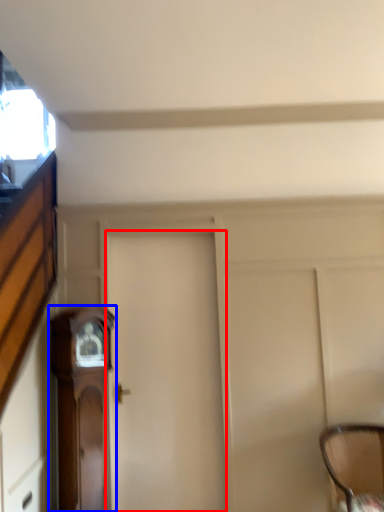
Question: Which of the following is the farthest to the observer, door (highlighted by a red box) or furniture (highlighted by a blue box)?

Choices:
 (A) door
 (B) furniture

Answer: (A)